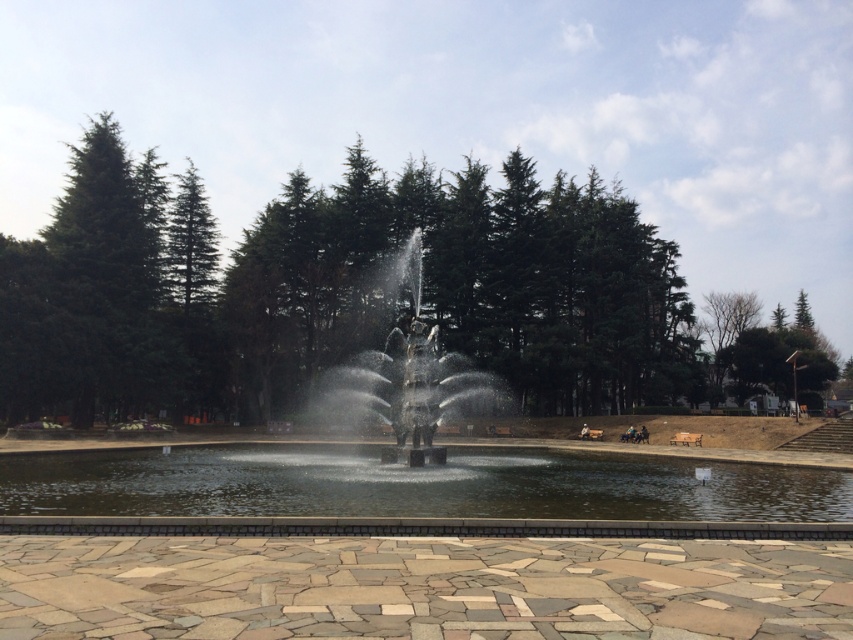
Question: Is green textured trees at center below polished bronze statue at center?

Choices:
 (A) no
 (B) yes

Answer: (A)

Question: Which object is closer to the camera taking this photo?

Choices:
 (A) polished bronze statue at center
 (B) clear water at center
 (C) green textured trees at center

Answer: (B)

Question: Which object is positioned closest to the green textured trees at center?

Choices:
 (A) clear water at center
 (B) polished bronze statue at center

Answer: (B)

Question: Does green textured trees at center have a lesser width compared to clear water at center?

Choices:
 (A) yes
 (B) no

Answer: (B)

Question: Considering the relative positions of clear water at center and polished bronze statue at center in the image provided, where is clear water at center located with respect to polished bronze statue at center?

Choices:
 (A) left
 (B) right

Answer: (A)

Question: Which object appears farthest from the camera in this image?

Choices:
 (A) polished bronze statue at center
 (B) green textured trees at center
 (C) clear water at center

Answer: (B)